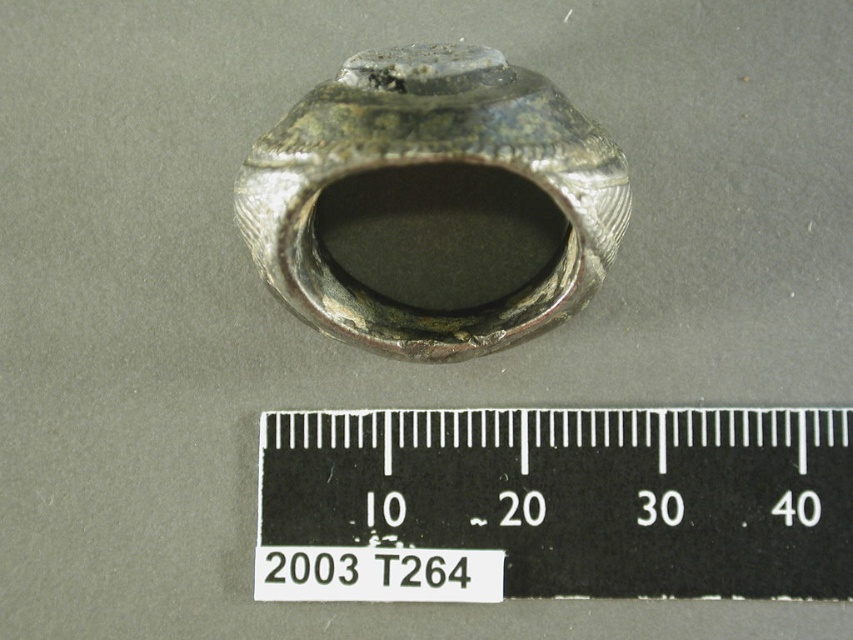
You are an archaeologist examining the image of the metallic object. You need to determine the exact location of the black plastic ruler at center in the image. What are its coordinates?

The coordinates of the black plastic ruler at center are at point (554,504).

You are an archaeologist examining the silver metallic ring at center and the black plastic ruler at center. Which object is located to the right of the other?

The black plastic ruler at center is positioned on the right side of silver metallic ring at center.